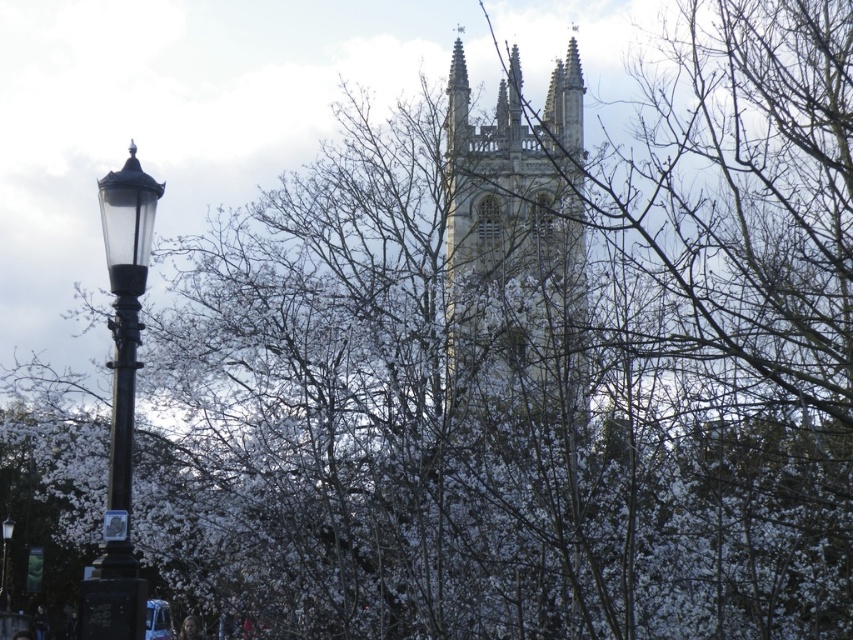
The height and width of the screenshot is (640, 853). Identify the location of white stone church at upper center. pos(517,252).

Between point (454, 301) and point (0, 608), which one is positioned in front?

Point (454, 301) is in front.

Where is `white stone church at upper center`? This screenshot has width=853, height=640. white stone church at upper center is located at coordinates (517, 252).

Does polished black lamp post at left have a larger size compared to black glass street light at left?

Yes, polished black lamp post at left is bigger than black glass street light at left.

Which is behind, point (96, 572) or point (6, 525)?

The point (6, 525) is more distant.

Who is more forward, [143,211] or [9,531]?

Point [143,211]

The image size is (853, 640). I want to click on polished black lamp post at left, so click(120, 401).

Can you confirm if white stone church at upper center is positioned to the right of polished black lamp post at left?

Indeed, white stone church at upper center is positioned on the right side of polished black lamp post at left.

Can you confirm if white stone church at upper center is bigger than polished black lamp post at left?

Yes.

Is point (543, 221) positioned behind point (131, 556)?

That is True.

Image resolution: width=853 pixels, height=640 pixels. I want to click on white stone church at upper center, so click(517, 252).